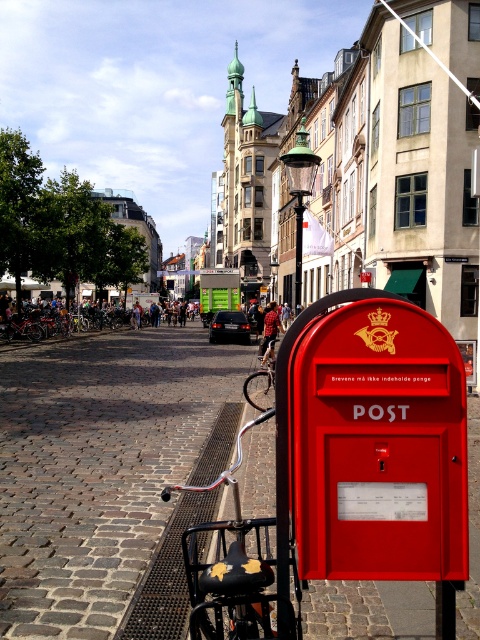
Can you confirm if cobblestone pavement at lower left is positioned to the left of red matte postbox at lower right?

Indeed, cobblestone pavement at lower left is positioned on the left side of red matte postbox at lower right.

Who is more distant from viewer, (79, 492) or (277, 428)?

Positioned behind is point (79, 492).

Locate an element on the screen. Image resolution: width=480 pixels, height=640 pixels. cobblestone pavement at lower left is located at coordinates (97, 467).

Between red matte postbox at lower right and black matte bicycle at lower left, which one appears on the right side from the viewer's perspective?

red matte postbox at lower right

Is point (345, 448) positioned behind point (252, 624)?

That is True.

Where is `red matte postbox at lower right`? Image resolution: width=480 pixels, height=640 pixels. red matte postbox at lower right is located at coordinates (372, 442).

Based on the photo, does cobblestone pavement at lower left appear under black matte bicycle at lower left?

Incorrect, cobblestone pavement at lower left is not positioned below black matte bicycle at lower left.

Which is more to the right, cobblestone pavement at lower left or black matte bicycle at lower left?

Positioned to the right is black matte bicycle at lower left.

Is point (49, 529) positioned behind point (275, 611)?

Yes, it is behind point (275, 611).

You are a GUI agent. You are given a task and a screenshot of the screen. Output one action in this format:
    pyautogui.click(x=<x>, y=<y>)
    Task: Click on the cobblestone pavement at lower left
    This screenshot has width=480, height=640.
    Given the screenshot: What is the action you would take?
    pyautogui.click(x=97, y=467)